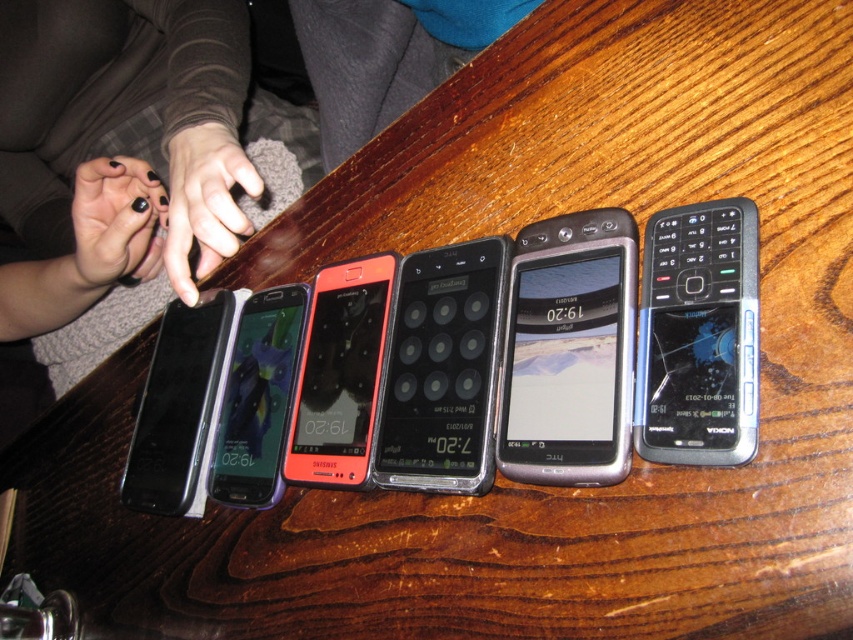
Question: Is metallic silver smartphone at center further to camera compared to black glossy smartphone at left?

Choices:
 (A) no
 (B) yes

Answer: (A)

Question: Which point is closer to the camera taking this photo?

Choices:
 (A) (361, 426)
 (B) (590, 250)
 (C) (262, 378)
 (D) (477, 278)

Answer: (B)

Question: Is metallic silver smartphone at center closer to camera compared to black plastic nokia phone at right?

Choices:
 (A) yes
 (B) no

Answer: (B)

Question: Is black matte keypad phone at center below black glossy smartphone at left?

Choices:
 (A) yes
 (B) no

Answer: (B)

Question: Based on their relative distances, which object is farther from the matte black smartphone at center?

Choices:
 (A) black plastic nokia phone at right
 (B) matte black phone at center
 (C) metallic silver smartphone at center

Answer: (A)

Question: Which is farther from the matte black phone at center?

Choices:
 (A) black plastic nokia phone at right
 (B) black matte nail polish at left
 (C) black glossy smartphone at left
 (D) black nail polish at left

Answer: (D)